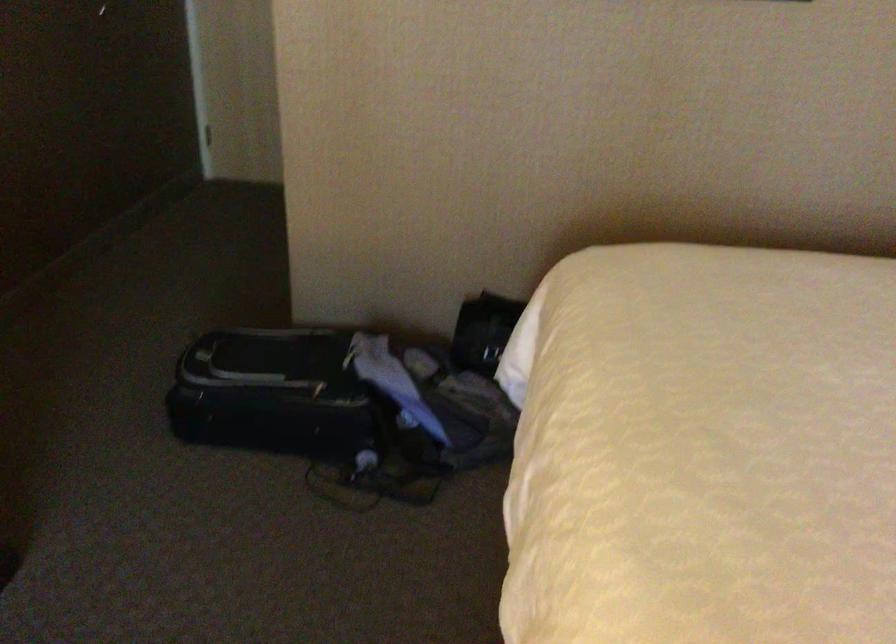
The width and height of the screenshot is (896, 644). What do you see at coordinates (280, 395) in the screenshot?
I see `a black bag` at bounding box center [280, 395].